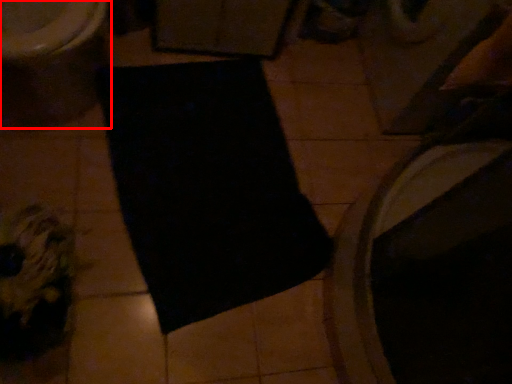
Question: From the image's perspective, where is toilet (annotated by the red box) located relative to yoga mat?

Choices:
 (A) below
 (B) above

Answer: (B)